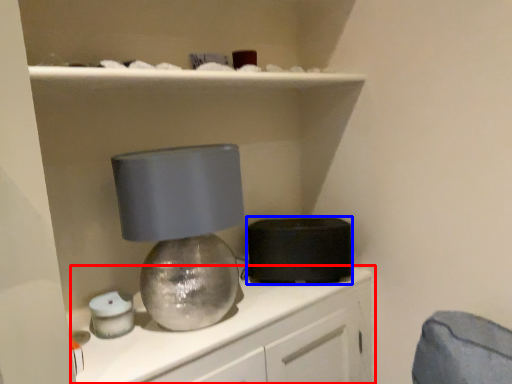
Question: Which point is further to the camera, cabinetry (highlighted by a red box) or appliance (highlighted by a blue box)?

Choices:
 (A) cabinetry
 (B) appliance

Answer: (B)